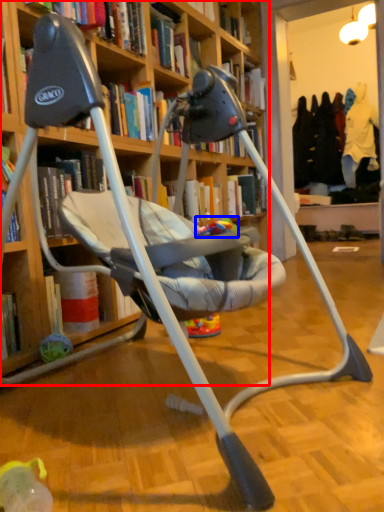
Question: Which of the following is the farthest to the observer, bookcase (highlighted by a red box) or toy (highlighted by a blue box)?

Choices:
 (A) bookcase
 (B) toy

Answer: (B)